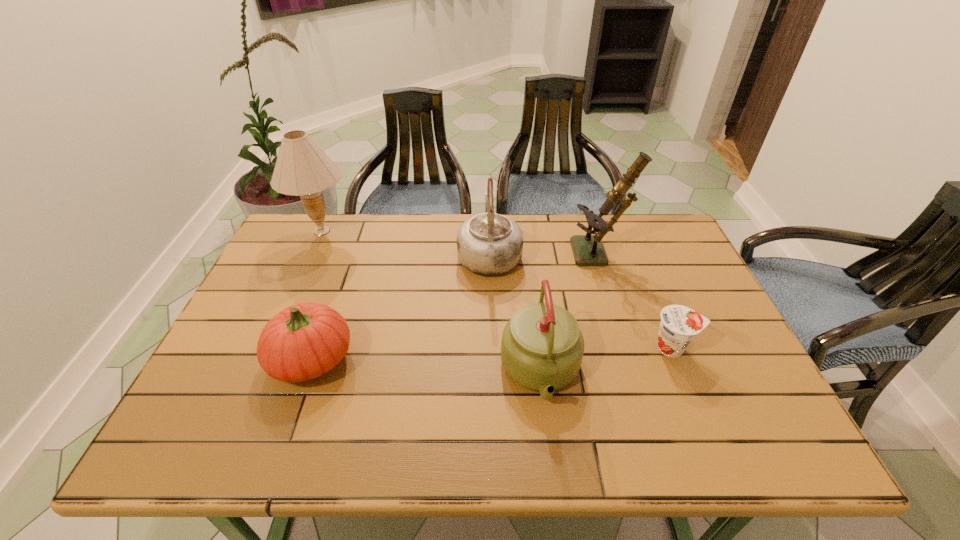
The height and width of the screenshot is (540, 960). Find the location of `vacant space situated 0.100m at the spout of the farther kettle`. vacant space situated 0.100m at the spout of the farther kettle is located at coordinates (489, 213).

The width and height of the screenshot is (960, 540). Identify the location of free space located at the spout of the farther kettle. (489, 218).

You are a GUI agent. You are given a task and a screenshot of the screen. Output one action in this format:
    pyautogui.click(x=<x>, y=<y>)
    Task: Click on the free space located 0.090m at the spout of the farther kettle
    
    Given the screenshot: What is the action you would take?
    pyautogui.click(x=489, y=215)

This screenshot has width=960, height=540. In order to click on vacant position located 0.120m on the right of the pumpkin in this screenshot , I will do `click(404, 359)`.

Where is `vacant point located on the back of the yogurt`? Image resolution: width=960 pixels, height=540 pixels. vacant point located on the back of the yogurt is located at coordinates (660, 319).

The height and width of the screenshot is (540, 960). In order to click on lampshade located in the far edge section of the desktop in this screenshot , I will do `click(302, 168)`.

Image resolution: width=960 pixels, height=540 pixels. I want to click on microscope that is at the far edge, so click(x=588, y=249).

The width and height of the screenshot is (960, 540). I want to click on kettle positioned at the far edge, so [x=489, y=244].

At what (x,y) coordinates should I click in order to perform the action: click on object that is positioned at the near edge. Please return your answer as a coordinate pair (x, y). The height and width of the screenshot is (540, 960). Looking at the image, I should click on (542, 347).

Where is `lampshade situated at the left edge`? Image resolution: width=960 pixels, height=540 pixels. lampshade situated at the left edge is located at coordinates (302, 168).